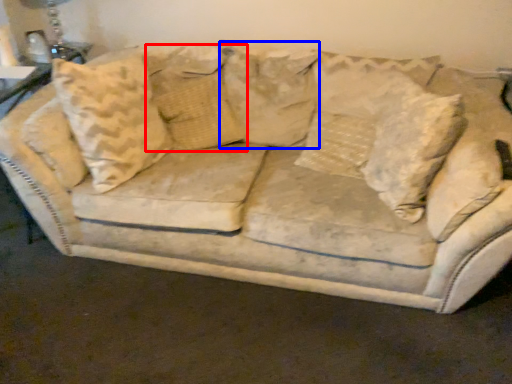
Question: Among these objects, which one is farthest to the camera, pillow (highlighted by a red box) or pillow (highlighted by a blue box)?

Choices:
 (A) pillow
 (B) pillow

Answer: (A)